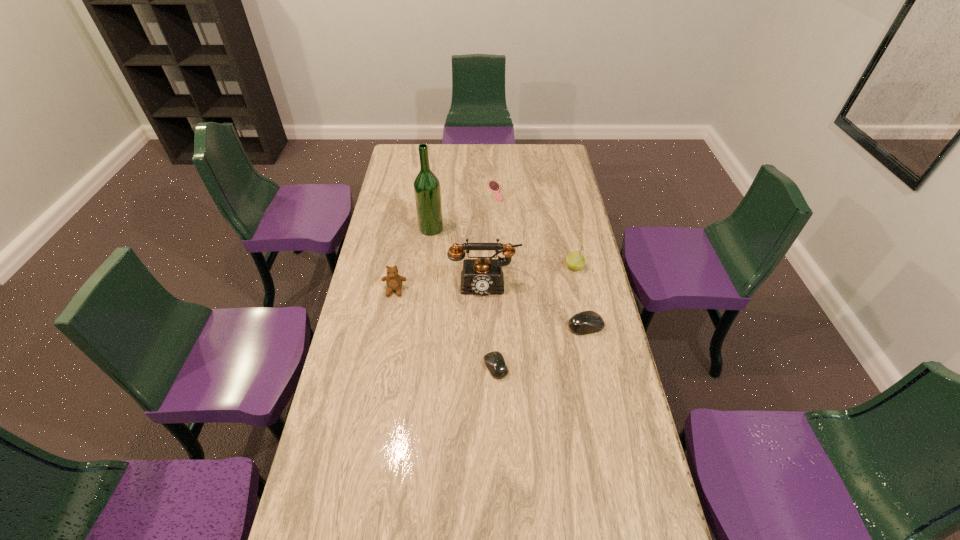
Where is `vacant point located between the second object from left to right and the sixth farthest object`? vacant point located between the second object from left to right and the sixth farthest object is located at coordinates (509, 277).

Locate an element on the screen. The height and width of the screenshot is (540, 960). object that is the sixth closest to the farther mouse is located at coordinates (494, 186).

Where is `the fourth closest object relative to the leftmost object`? the fourth closest object relative to the leftmost object is located at coordinates (586, 322).

This screenshot has height=540, width=960. What are the coordinates of `free space that satisfies the following two spatial constraints: 1. on the front side of the farthest object; 2. on the right side of the sixth farthest object` in the screenshot? It's located at (500, 326).

The width and height of the screenshot is (960, 540). I want to click on vacant area that satisfies the following two spatial constraints: 1. on the front of the telephone at the rotary dial; 2. on the left side of the nearest object, so click(x=486, y=367).

Identify the location of free space that satisfies the following two spatial constraints: 1. on the front-facing side of the shorter mouse; 2. on the right side of the teddy bear. The height and width of the screenshot is (540, 960). (381, 367).